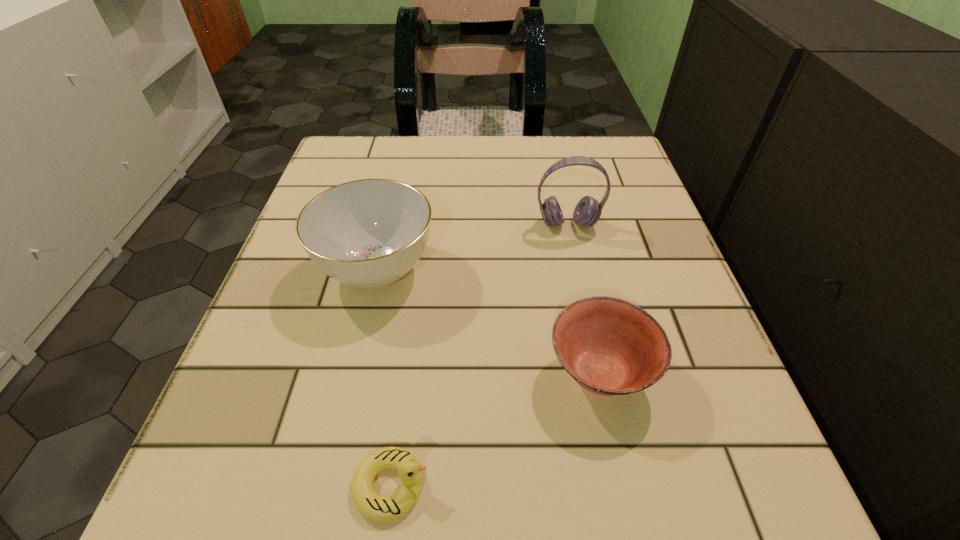
This screenshot has width=960, height=540. In order to click on object that is at the near edge in this screenshot , I will do `click(367, 501)`.

The width and height of the screenshot is (960, 540). I want to click on object that is at the left edge, so click(x=369, y=233).

Locate an element on the screen. This screenshot has width=960, height=540. headset at the right edge is located at coordinates (587, 212).

The image size is (960, 540). Find the location of `bowl positioned at the right edge`. bowl positioned at the right edge is located at coordinates (610, 346).

Find the location of a particular element. free space at the far edge of the desktop is located at coordinates (516, 138).

Find the location of a particular element. vacant space at the near edge is located at coordinates coord(410,526).

This screenshot has width=960, height=540. What are the coordinates of `vacant area at the left edge` in the screenshot? It's located at (286, 330).

Identify the location of vacant space at the right edge of the desktop. (651, 218).

The image size is (960, 540). In order to click on vacant point at the near left corner in this screenshot , I will do `click(243, 472)`.

The width and height of the screenshot is (960, 540). What are the coordinates of `free space at the far right corner of the desktop` in the screenshot? It's located at (618, 151).